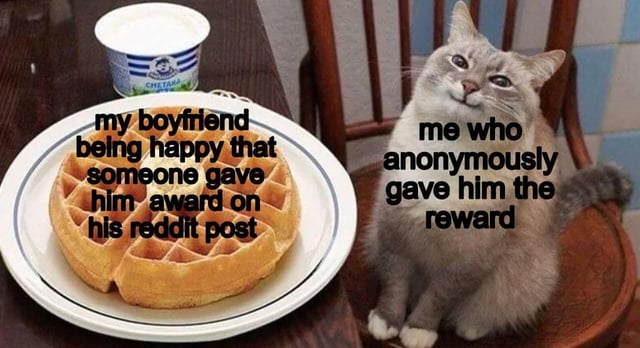
Identify the location of table. (61, 68).